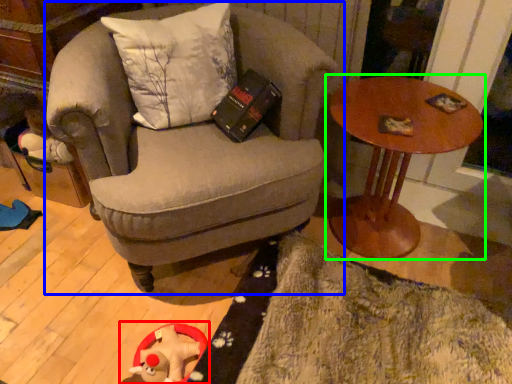
Question: Which is farther away from toy (highlighted by a red box)? chair (highlighted by a blue box) or table (highlighted by a green box)?

Choices:
 (A) chair
 (B) table

Answer: (B)